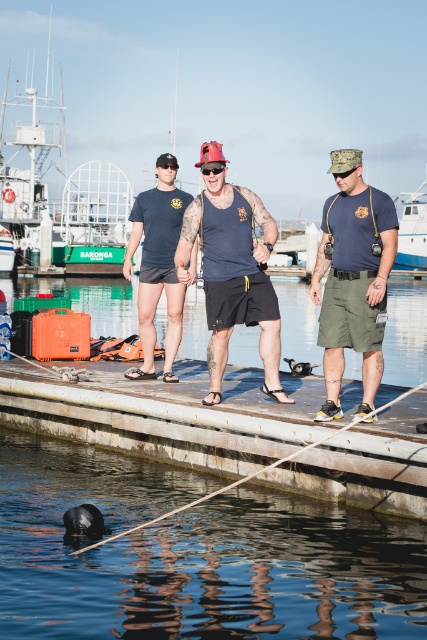
You are a photographer trying to capture a clear photo of the red reflective plastic goggles at center. However, the matte olive green shorts at center are blocking your view. Can you move around to the side to get an unobstructed shot?

The matte olive green shorts at center is in front of the red reflective plastic goggles at center, so moving to the side might allow you to see around the shorts and capture the goggles without obstruction.

Looking at this image, you are standing on the wooden dock and want to place a small potted plant between the two points marked as point (316, 298) and point (207, 163). Which point should the plant be closer to in order to be nearer to the viewer?

The plant should be placed closer to point (316, 298) because it is closer to the viewer than point (207, 163).

You are a photographer trying to capture the scene from the water level. Which object, the matte black tank top at center or the black matte goggles at center, will appear higher in your photo?

The matte black tank top at center appears higher in the photo because it has a greater height compared to the black matte goggles at center.